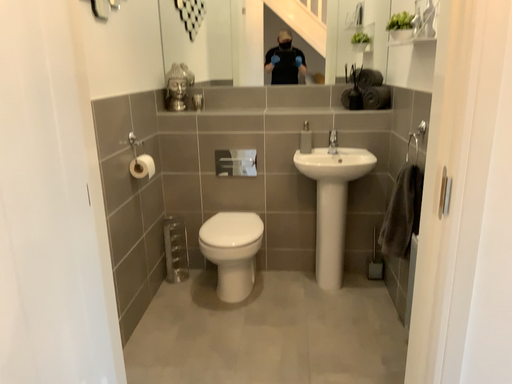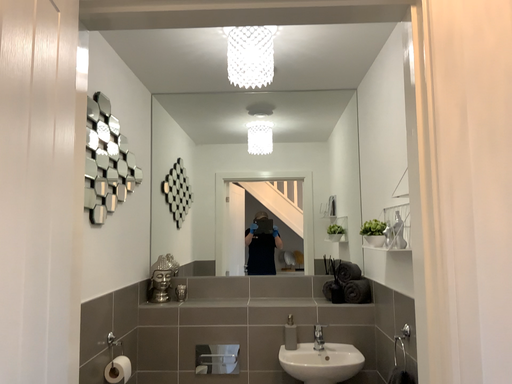
Question: Which way did the camera rotate in the video?

Choices:
 (A) rotated upward
 (B) rotated downward

Answer: (A)